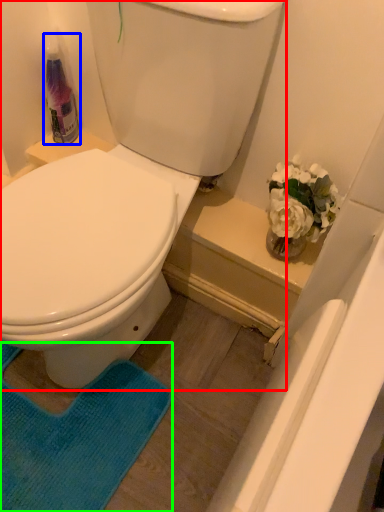
Question: Which object is the farthest from toilet (highlighted by a red box)? Choose among these: cleaning product (highlighted by a blue box) or yoga mat (highlighted by a green box).

Choices:
 (A) cleaning product
 (B) yoga mat

Answer: (B)